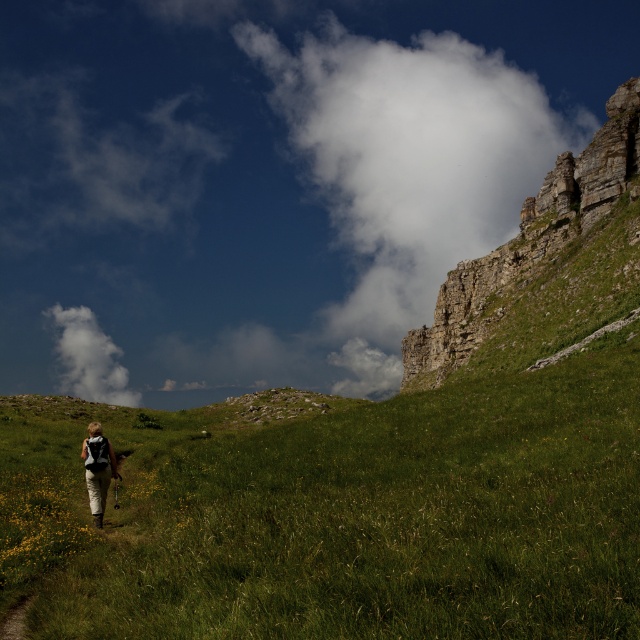
Between rugged stone cliff at upper right and white fluffy cloud at upper left, which one appears on the right side from the viewer's perspective?

Positioned to the right is rugged stone cliff at upper right.

Does rugged stone cliff at upper right have a lesser width compared to white fluffy cloud at upper left?

Yes, rugged stone cliff at upper right is thinner than white fluffy cloud at upper left.

Which is in front, point (564, 177) or point (93, 340)?

Point (564, 177) is more forward.

At what (x,y) coordinates should I click in order to perform the action: click on rugged stone cliff at upper right. Please return your answer as a coordinate pair (x, y). This screenshot has height=640, width=640. Looking at the image, I should click on (529, 241).

The width and height of the screenshot is (640, 640). Describe the element at coordinates (408, 166) in the screenshot. I see `white fluffy cloud at upper center` at that location.

Is point (500, 125) farther from viewer compared to point (70, 330)?

Yes, point (500, 125) is farther from viewer.

Where is `white fluffy cloud at upper center`? The width and height of the screenshot is (640, 640). white fluffy cloud at upper center is located at coordinates (408, 166).

This screenshot has height=640, width=640. In order to click on white fluffy cloud at upper left in this screenshot , I will do `click(88, 356)`.

The height and width of the screenshot is (640, 640). What do you see at coordinates (88, 356) in the screenshot?
I see `white fluffy cloud at upper left` at bounding box center [88, 356].

Which is behind, point (72, 358) or point (97, 513)?

Point (72, 358)

Locate an element on the screen. The width and height of the screenshot is (640, 640). white fluffy cloud at upper left is located at coordinates pyautogui.click(x=88, y=356).